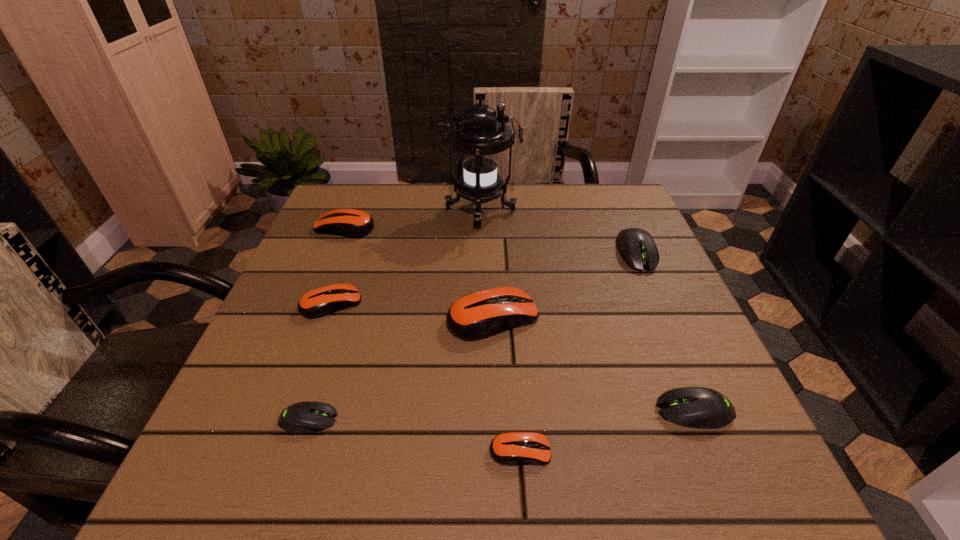
Identify the location of free point at the near right corner. [655, 460].

Where is `free space between the biggest orange computer mouse and the second biggest orange computer mouse`? The width and height of the screenshot is (960, 540). free space between the biggest orange computer mouse and the second biggest orange computer mouse is located at coordinates (419, 272).

At what (x,y) coordinates should I click in order to perform the action: click on empty location between the smallest gray computer mouse and the second biggest gray computer mouse. Please return your answer as a coordinate pair (x, y). Looking at the image, I should click on (501, 415).

Locate an element on the screen. vacant space that is in between the smallest gray computer mouse and the second smallest orange computer mouse is located at coordinates (321, 361).

The height and width of the screenshot is (540, 960). What are the coordinates of `vacant region between the third smallest orange computer mouse and the black lantern` in the screenshot? It's located at (413, 219).

You are a GUI agent. You are given a task and a screenshot of the screen. Output one action in this format:
    pyautogui.click(x=<x>, y=<y>)
    Task: Click on the vacant area between the second biggest gray computer mouse and the leftmost gray computer mouse
    The height and width of the screenshot is (540, 960).
    Given the screenshot: What is the action you would take?
    pyautogui.click(x=501, y=415)

This screenshot has height=540, width=960. I want to click on free space between the third smallest orange computer mouse and the farthest gray computer mouse, so click(491, 240).

The width and height of the screenshot is (960, 540). I want to click on empty space that is in between the black lantern and the second biggest gray computer mouse, so click(x=588, y=311).

You are a GUI agent. You are given a task and a screenshot of the screen. Output one action in this format:
    pyautogui.click(x=<x>, y=<y>)
    Task: Click on the vacant space in between the farthest gray computer mouse and the second smallest orange computer mouse
    
    Given the screenshot: What is the action you would take?
    pyautogui.click(x=484, y=278)

You are a GUI agent. You are given a task and a screenshot of the screen. Output one action in this format:
    pyautogui.click(x=<x>, y=<y>)
    Task: Click on the vacant space that is in between the lantern and the second biggest gray computer mouse
    The height and width of the screenshot is (540, 960).
    Given the screenshot: What is the action you would take?
    pyautogui.click(x=588, y=311)